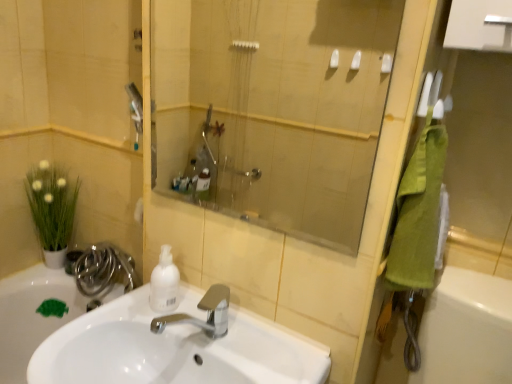
What are the coordinates of `green towel at right` in the screenshot? It's located at (418, 212).

Describe the element at coordinates (174, 350) in the screenshot. I see `white glossy sink at center` at that location.

Measure the distance between point (63, 221) and camera.

Point (63, 221) is 1.64 meters from camera.

The height and width of the screenshot is (384, 512). I want to click on green towel at right, so click(418, 212).

Is the position of white glossy sink at center less distant than that of green matte soap dispenser at lower left?

Yes, it is.

Could you tell me if white glossy sink at center is turned towards green matte soap dispenser at lower left?

No, white glossy sink at center is not turned towards green matte soap dispenser at lower left.

Is white glossy sink at center taller than green matte soap dispenser at lower left?

Indeed, white glossy sink at center has a greater height compared to green matte soap dispenser at lower left.

Based on the photo, does transparent glass shower at center come in front of polished chrome hose at lower left?

Yes, transparent glass shower at center is in front of polished chrome hose at lower left.

Does transparent glass shower at center appear on the left side of polished chrome hose at lower left?

No.

From a real-world perspective, is transparent glass shower at center on polished chrome hose at lower left?

Yes, from a real-world perspective, transparent glass shower at center is over polished chrome hose at lower left

Can you tell me how much transparent glass shower at center and polished chrome hose at lower left differ in facing direction?

The angle between the facing direction of transparent glass shower at center and the facing direction of polished chrome hose at lower left is 3.14 degrees.

From the image's perspective, between polished chrome hose at lower left and white glossy sink at center, which one is located above?

polished chrome hose at lower left is shown above in the image.

Is polished chrome hose at lower left situated inside white glossy sink at center or outside?

polished chrome hose at lower left is not inside white glossy sink at center, it's outside.

Where is `sink on the right of polished chrome hose at lower left`? The height and width of the screenshot is (384, 512). sink on the right of polished chrome hose at lower left is located at coordinates (174, 350).

Is polished chrome hose at lower left facing away from white glossy sink at center?

No, polished chrome hose at lower left is not facing away from white glossy sink at center.

At what (x,y) coordinates should I click in order to perform the action: click on mirror behind the white glossy sink at center. Please return your answer as a coordinate pair (x, y). The height and width of the screenshot is (384, 512). Looking at the image, I should click on (273, 108).

From the picture: Considering the sizes of white glossy sink at center and transparent glass shower at center in the image, is white glossy sink at center bigger or smaller than transparent glass shower at center?

In the image, white glossy sink at center appears to be larger than transparent glass shower at center.

From the image's perspective, between white glossy sink at center and transparent glass shower at center, who is located below?

From the image's view, white glossy sink at center is below.

Consider the image. Can you confirm if green towel at right is taller than green matte plant at left?

No.

Is green towel at right far from green matte plant at left?

Yes, green towel at right is far from green matte plant at left.

From the image's perspective, which one is positioned higher, green towel at right or green matte plant at left?

green towel at right appears higher in the image.

Is green towel at right not inside green matte plant at left?

green towel at right lies outside green matte plant at left's area.

Does green matte soap dispenser at lower left lie behind polished chrome hose at lower left?

No, green matte soap dispenser at lower left is closer to the camera.

From the picture: Can you confirm if green matte soap dispenser at lower left is wider than polished chrome hose at lower left?

Correct, the width of green matte soap dispenser at lower left exceeds that of polished chrome hose at lower left.

Which of these two, green matte soap dispenser at lower left or polished chrome hose at lower left, stands shorter?

polished chrome hose at lower left is shorter.

How much distance is there between green matte soap dispenser at lower left and polished chrome hose at lower left?

green matte soap dispenser at lower left and polished chrome hose at lower left are 15.81 centimeters apart.

This screenshot has width=512, height=384. Identify the location of flower on the left side of polished chrome hose at lower left. (51, 204).

Can you confirm if polished chrome hose at lower left is positioned to the left of green matte plant at left?

No.

Is polished chrome hose at lower left not close to green matte plant at left?

They are positioned close to each other.

Locate an element on the screen. plain behind the white glossy sink at center is located at coordinates (33, 315).

Locate an element on the screen. plumbing fixture located underneath the transparent glass shower at center (from a real-world perspective) is located at coordinates (103, 270).

From the image, which object appears to be farther from green towel at right, polished chrome hose at lower left or white glossy sink at center?

Based on the image, polished chrome hose at lower left appears to be further to green towel at right.

Based on their spatial positions, is white glossy sink at center or green matte plant at left closer to green matte soap dispenser at lower left?

Based on the image, green matte plant at left appears to be nearer to green matte soap dispenser at lower left.

Which object lies nearer to the anchor point white matte bottle at center, polished chrome hose at lower left or green towel at right?

green towel at right is positioned closer to the anchor white matte bottle at center.

When comparing their distances from green matte plant at left, does polished chrome hose at lower left or white glossy sink at center seem further?

Among the two, white glossy sink at center is located further to green matte plant at left.

Looking at the image, which one is located closer to polished chrome hose at lower left, green matte soap dispenser at lower left or transparent glass shower at center?

green matte soap dispenser at lower left is positioned closer to the anchor polished chrome hose at lower left.

Based on their spatial positions, is transparent glass shower at center or white glossy sink at center closer to green matte soap dispenser at lower left?

The object closer to green matte soap dispenser at lower left is white glossy sink at center.

Estimate the real-world distances between objects in this image. Which object is further from green matte plant at left, polished chrome hose at lower left or green matte soap dispenser at lower left?

Among the two, green matte soap dispenser at lower left is located further to green matte plant at left.

Based on the photo, when comparing their distances from green matte soap dispenser at lower left, does green matte plant at left or green towel at right seem closer?

The object closer to green matte soap dispenser at lower left is green matte plant at left.

You are a GUI agent. You are given a task and a screenshot of the screen. Output one action in this format:
    pyautogui.click(x=<x>, y=<y>)
    Task: Click on the plumbing fixture between green matte plant at left and green towel at right from left to right
    The image size is (512, 384).
    Given the screenshot: What is the action you would take?
    pyautogui.click(x=103, y=270)

You are a GUI agent. You are given a task and a screenshot of the screen. Output one action in this format:
    pyautogui.click(x=<x>, y=<y>)
    Task: Click on the cleaning product that lies between transparent glass shower at center and white glossy sink at center from top to bottom
    This screenshot has height=384, width=512.
    Given the screenshot: What is the action you would take?
    pyautogui.click(x=164, y=283)

I want to click on plumbing fixture between green matte plant at left and green matte soap dispenser at lower left in the vertical direction, so click(103, 270).

I want to click on sink between polished chrome hose at lower left and green towel at right, so click(x=174, y=350).